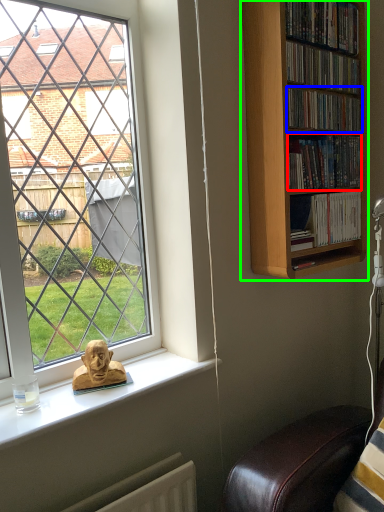
Question: Based on their relative distances, which object is farther from book (highlighted by a red box)? Choose from book (highlighted by a blue box) and bookcase (highlighted by a green box).

Choices:
 (A) book
 (B) bookcase

Answer: (B)